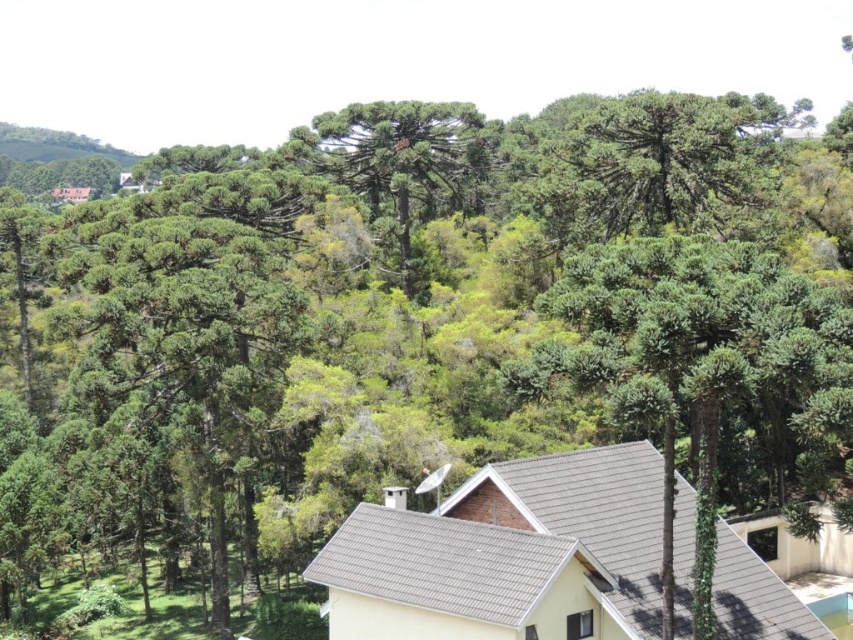
You are standing in the residential area in front of the house with the satellite dish and chimney. You see two points marked in the image. Which point, point (x=805, y=348) or point (x=416, y=212), is closer to you?

Point (x=805, y=348) is closer to the viewer than point (x=416, y=212).

You are standing in front of the house with the dark gray tiled roof and want to determine which tree is closer to you between the green leafy tree at center and the green textured tree at center. Based on their sizes, can you figure out which one is nearer?

The green leafy tree at center has a larger size compared to the green textured tree at center, so the green leafy tree at center is closer to you since objects closer appear larger.